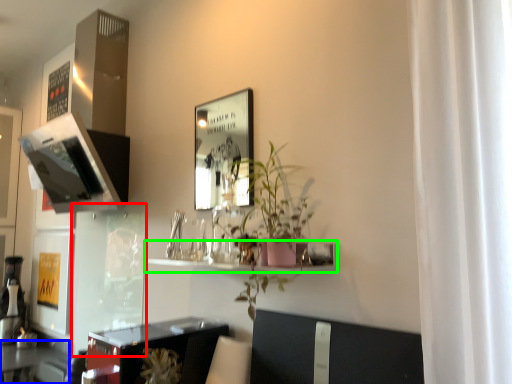
Question: Which object is positioned closest to glass door (highlighted by a red box)? Select from table (highlighted by a blue box) and shelf (highlighted by a green box).

Choices:
 (A) table
 (B) shelf

Answer: (A)